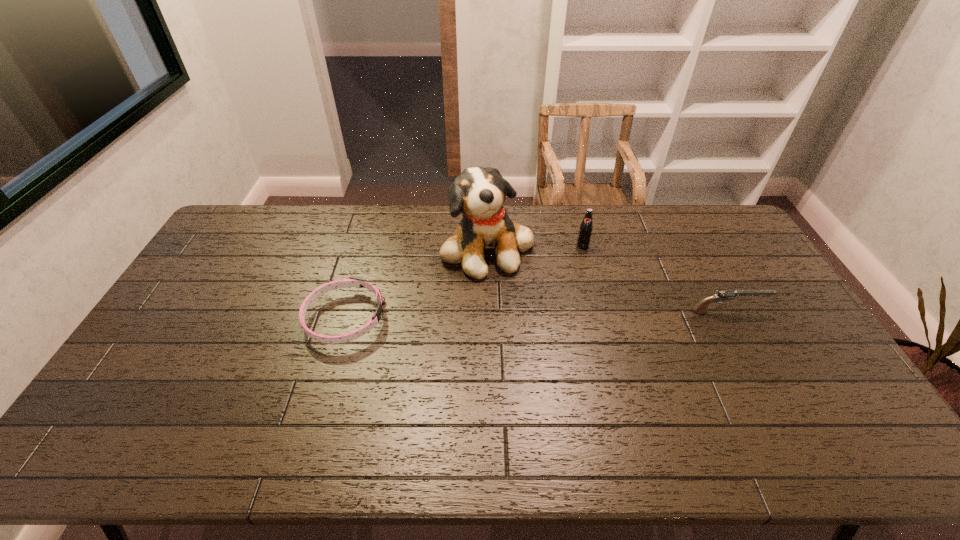
Find the location of a particular element. free space located on the front label of the second object from right to left is located at coordinates (579, 312).

What are the coordinates of `vacant space located 0.390m on the front label of the second object from right to left` in the screenshot? It's located at tap(578, 335).

Locate an element on the screen. Image resolution: width=960 pixels, height=540 pixels. free space located 0.260m on the front label of the second object from right to left is located at coordinates (580, 302).

Find the location of a particular element. free location located at the face of the puppy is located at coordinates (555, 329).

The image size is (960, 540). I want to click on vacant area situated 0.220m at the face of the puppy, so click(x=549, y=322).

This screenshot has width=960, height=540. What are the coordinates of `vacant space located at the face of the puppy` in the screenshot? It's located at (565, 341).

At what (x,y) coordinates should I click in order to perform the action: click on pop that is at the far edge. Please return your answer as a coordinate pair (x, y). Image resolution: width=960 pixels, height=540 pixels. Looking at the image, I should click on (585, 230).

The height and width of the screenshot is (540, 960). What are the coordinates of `puppy present at the far edge` in the screenshot? It's located at (478, 193).

The image size is (960, 540). Find the location of `object located at the right edge`. object located at the right edge is located at coordinates (724, 295).

This screenshot has height=540, width=960. Identify the location of vacant space at the far edge of the desktop. (647, 244).